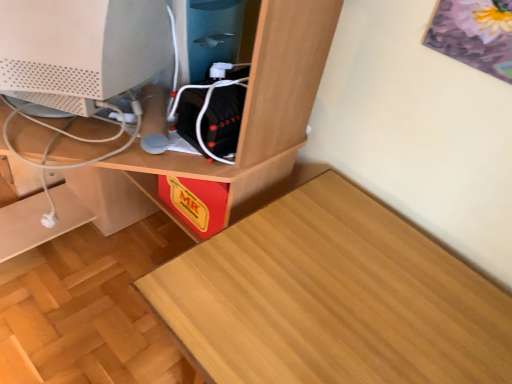
Question: Is wooden desk at center positioned with its back to wooden table at lower left?

Choices:
 (A) no
 (B) yes

Answer: (A)

Question: Does wooden desk at center have a greater width compared to wooden table at lower left?

Choices:
 (A) yes
 (B) no

Answer: (A)

Question: From the image's perspective, is wooden desk at center on top of wooden table at lower left?

Choices:
 (A) yes
 (B) no

Answer: (A)

Question: Would you consider wooden desk at center to be distant from wooden table at lower left?

Choices:
 (A) no
 (B) yes

Answer: (A)

Question: Can you confirm if wooden desk at center is taller than wooden table at lower left?

Choices:
 (A) yes
 (B) no

Answer: (A)

Question: Is point (68, 9) closer or farther from the camera than point (74, 41)?

Choices:
 (A) farther
 (B) closer

Answer: (B)

Question: In terms of width, does wooden desk at center look wider or thinner when compared to white matte computer monitor at center?

Choices:
 (A) wide
 (B) thin

Answer: (A)

Question: Considering the positions of wooden desk at center and white matte computer monitor at center in the image, is wooden desk at center bigger or smaller than white matte computer monitor at center?

Choices:
 (A) big
 (B) small

Answer: (A)

Question: From their relative heights in the image, would you say wooden desk at center is taller or shorter than white matte computer monitor at center?

Choices:
 (A) tall
 (B) short

Answer: (A)

Question: In the image, is wooden table at lower left positioned in front of or behind white matte computer monitor at center?

Choices:
 (A) behind
 (B) front

Answer: (B)

Question: Would you say wooden table at lower left is inside or outside white matte computer monitor at center?

Choices:
 (A) outside
 (B) inside

Answer: (A)

Question: Does point (401, 370) appear closer or farther from the camera than point (116, 44)?

Choices:
 (A) closer
 (B) farther

Answer: (A)

Question: In terms of size, does wooden table at lower left appear bigger or smaller than white matte computer monitor at center?

Choices:
 (A) big
 (B) small

Answer: (A)

Question: From the image's perspective, is wooden desk at center positioned above or below wooden table at lower left?

Choices:
 (A) below
 (B) above

Answer: (B)

Question: Looking at their shapes, would you say wooden desk at center is wider or thinner than wooden table at lower left?

Choices:
 (A) thin
 (B) wide

Answer: (B)